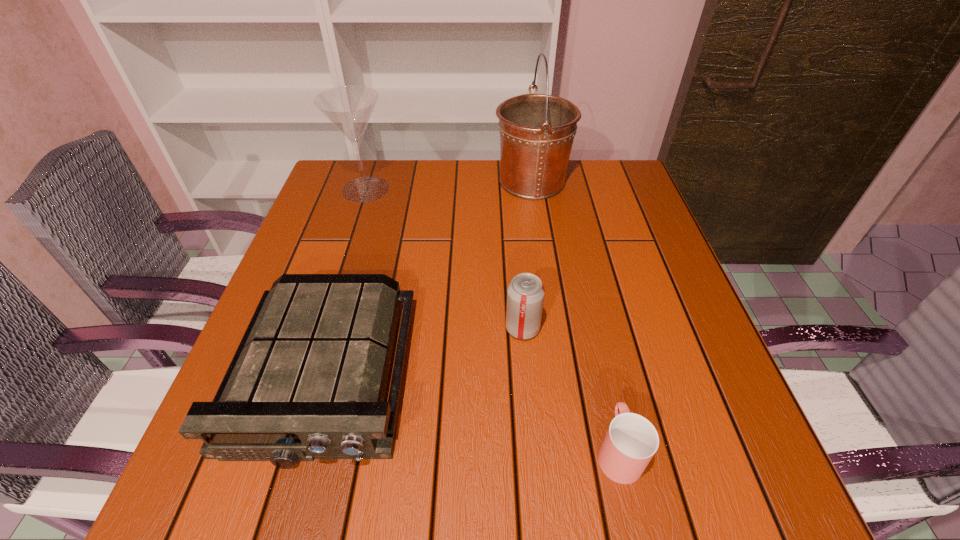
The image size is (960, 540). Find the location of `vacant space located on the side of the cup with the handle`. vacant space located on the side of the cup with the handle is located at coordinates (576, 263).

I want to click on bucket that is at the far edge, so click(537, 131).

The height and width of the screenshot is (540, 960). Identify the location of flute glass that is at the far edge. (349, 108).

Where is `radio receiver situated at the near edge`? radio receiver situated at the near edge is located at coordinates (308, 380).

The height and width of the screenshot is (540, 960). In order to click on cup present at the near edge in this screenshot , I will do `click(631, 441)`.

This screenshot has width=960, height=540. I want to click on flute glass that is at the left edge, so click(x=349, y=108).

At what (x,y) coordinates should I click in order to perform the action: click on radio receiver at the left edge. Please return your answer as a coordinate pair (x, y). Looking at the image, I should click on (308, 380).

The height and width of the screenshot is (540, 960). I want to click on object that is at the far left corner, so click(349, 108).

Where is `object at the near left corner`? Image resolution: width=960 pixels, height=540 pixels. object at the near left corner is located at coordinates (308, 380).

This screenshot has height=540, width=960. In the image, there is a desktop. What are the coordinates of `vacant space at the far edge` in the screenshot? It's located at (467, 204).